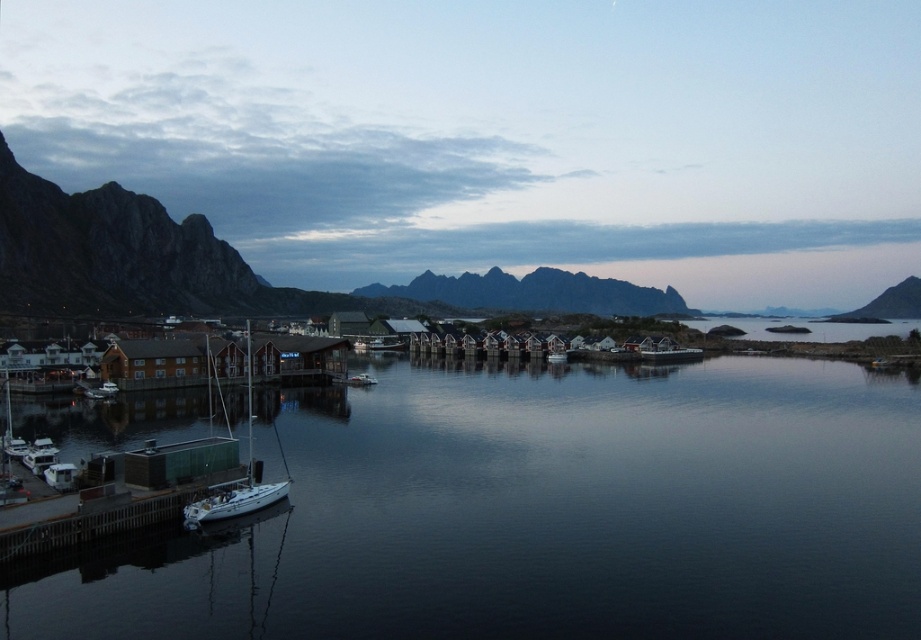
You are a photographer planning to take a picture of the white matte sailboat at lower left and the rugged stone mountain at right. Based on their positions, which object is closer to the left edge of the photo?

The white matte sailboat at lower left is closer to the left edge of the photo since it is positioned on the left side of the rugged stone mountain at right.

You are a photographer planning to take a photo of the white matte sailboat at lower left and the rugged stone mountain at right. Which object will appear smaller in the photo?

The white matte sailboat at lower left will appear smaller in the photo because it is shorter than the rugged stone mountain at right.